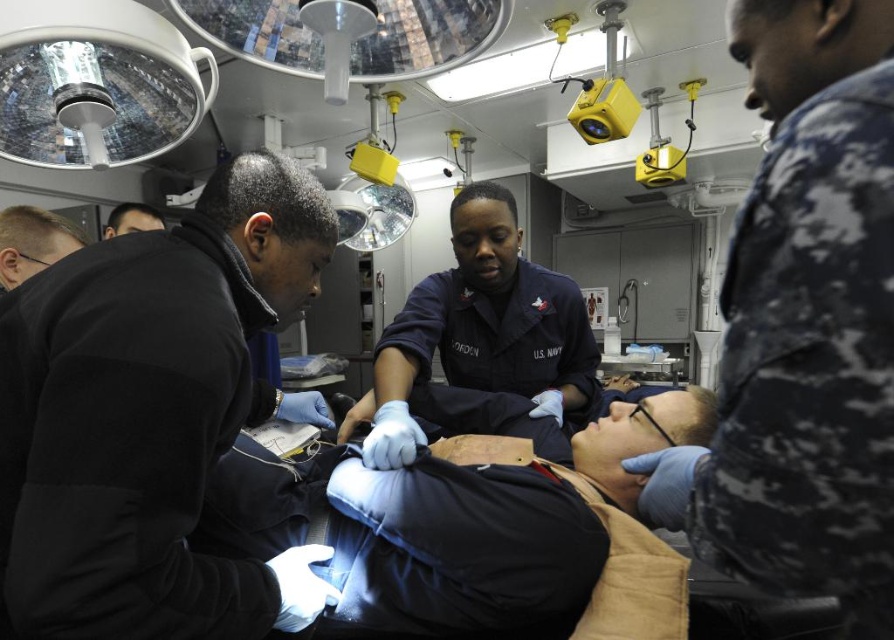
You are a medical technician in the shipboard medical facility. You need to locate the black matte jacket at left. According to the coordinates provided, where exactly is it positioned?

The black matte jacket at left is positioned at coordinates point [152,417].

You are a medical orderly in the shipboard clinic. You need to move the black matte jacket at left and the dark blue uniform at center to make space for a stretcher. Based on their sizes, which item will be easier to move first?

The black matte jacket at left occupies less space than dark blue uniform at center, so it will be easier to move first because it takes up less area.

You are a medical assistant in the shipboard clinic. You need to position the camouflage uniform at center and the dark blue uniform at center so that the shorter one is closer to the surgical lights. Which uniform should be placed closer?

The camouflage uniform at center is not as tall as dark blue uniform at center, so the camouflage uniform at center should be placed closer to the surgical lights to ensure adequate visibility.